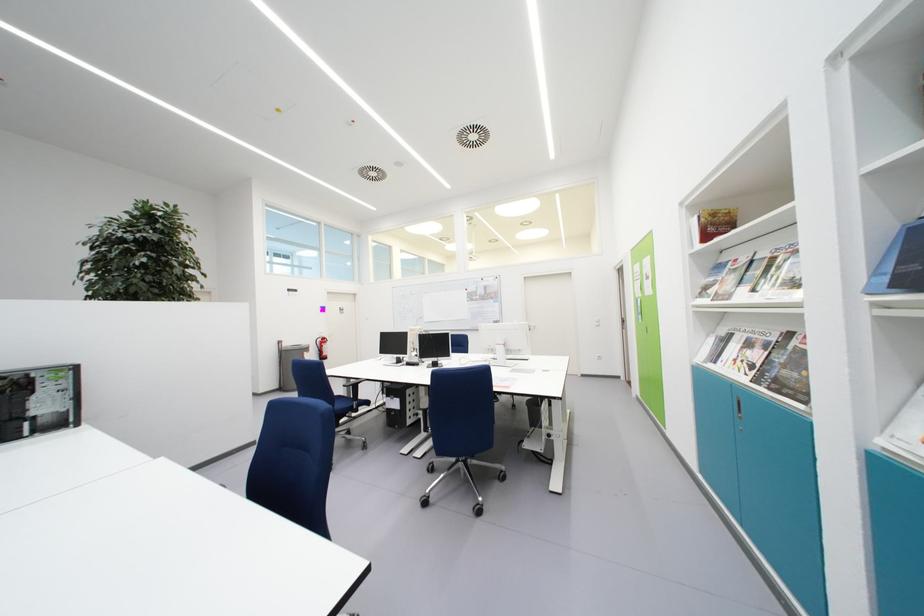
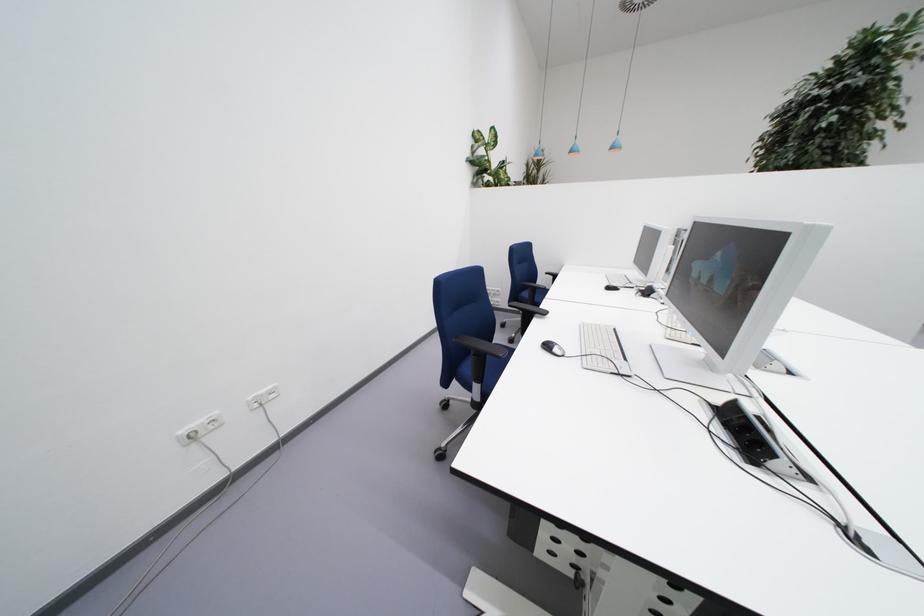
Based on the continuous images, in which direction is the camera rotating?

The rotation direction of the camera is left-down.